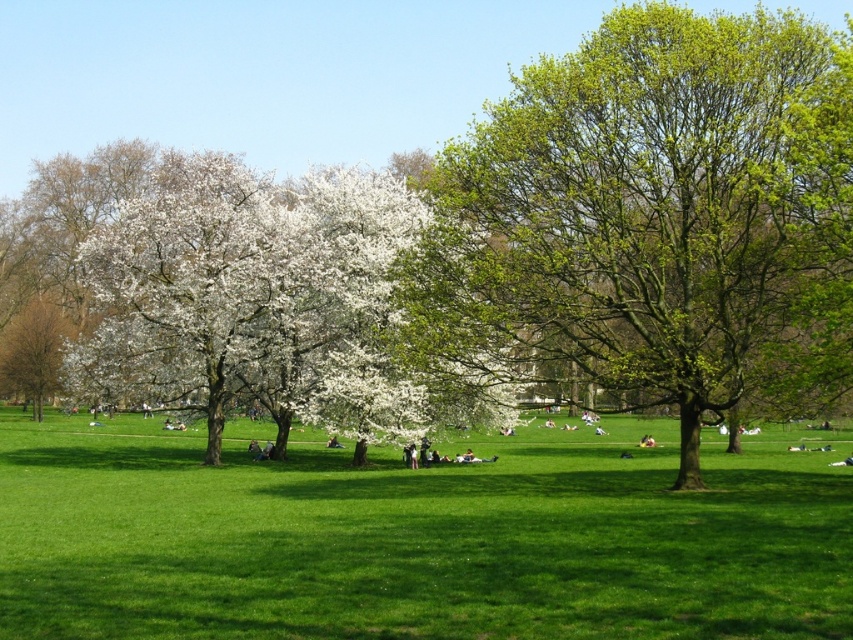
In the scene shown: You are planning to take a photo of the white blossoms at center and the smooth white blossoms at left. Which one should you focus on if you want to capture the larger blossoms in your shot?

The white blossoms at center is bigger than the smooth white blossoms at left, so you should focus on the white blossoms at center to capture the larger blossoms in your shot.

You are standing in the park and want to take a photo of the green grassy field at center and the green leafy tree at center. Which one should you focus on first if you want to capture both in the same frame?

The green grassy field at center is below the green leafy tree at center, so you should focus on the green leafy tree at center first to ensure both are in the frame.

You are a photographer standing in the park and want to capture a photo that includes both the green grassy field at center and the white blossoms at center. Based on their positions, which object should you frame first to ensure both are in the shot?

The white blossoms at center are on the left side of the green grassy field at center, so you should frame the white blossoms at center first to ensure both are included in the shot.